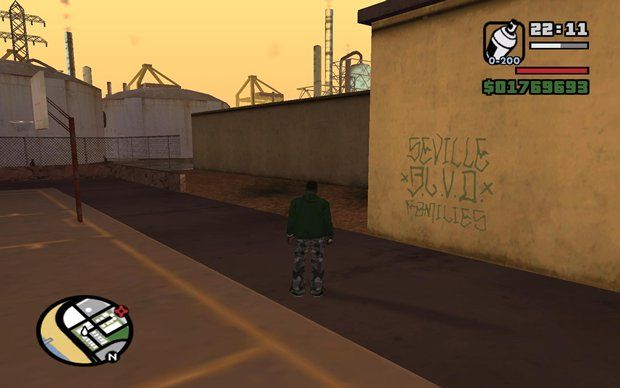
Find the location of a particular element. time on the clock is located at coordinates (544, 32), (570, 31), (587, 29), (559, 30).